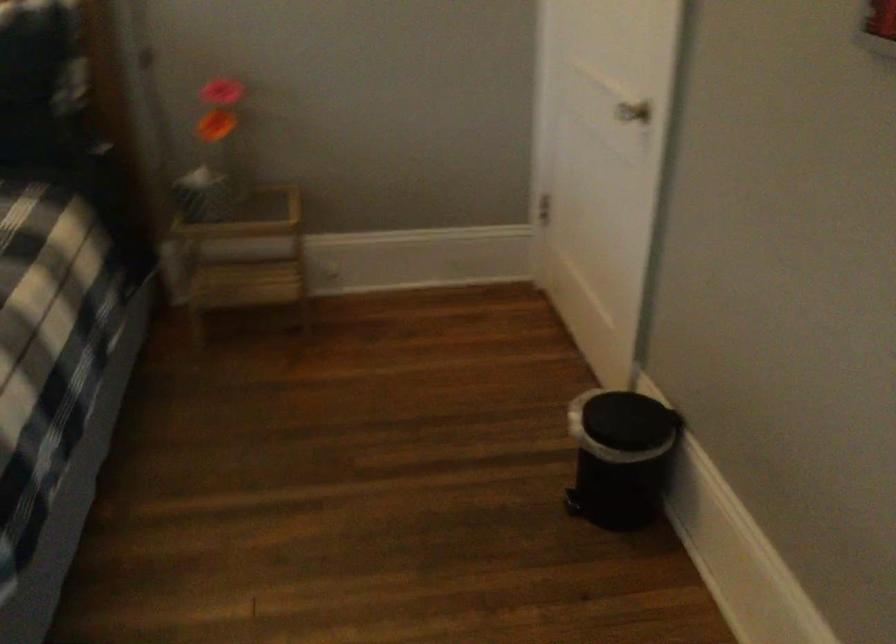
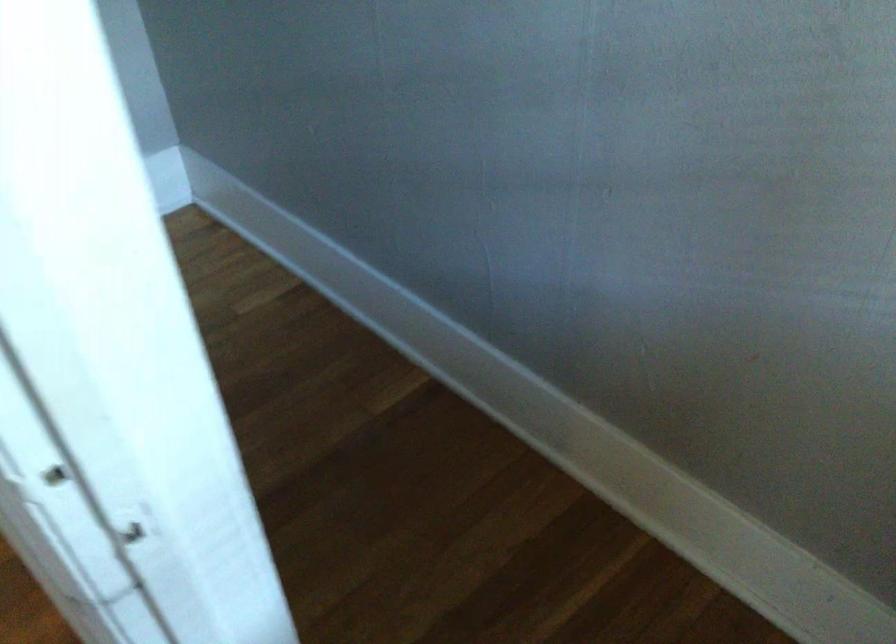
The first image is from the beginning of the video and the second image is from the end. How did the camera likely rotate when shooting the video?

The rotation direction of the camera is right-down.